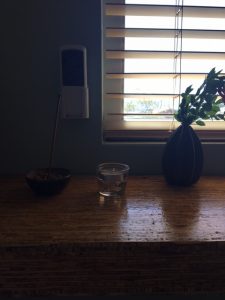
This screenshot has width=225, height=300. I want to click on white wall device, so click(x=73, y=98).